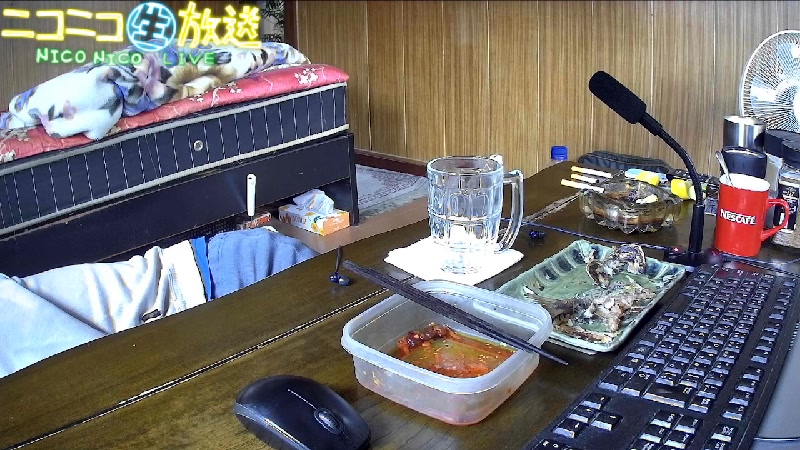
At what (x,y) coordinates should I click in order to perform the action: click on bowl. Please return your answer as a coordinate pair (x, y). This screenshot has height=450, width=800. Looking at the image, I should click on (442, 360).